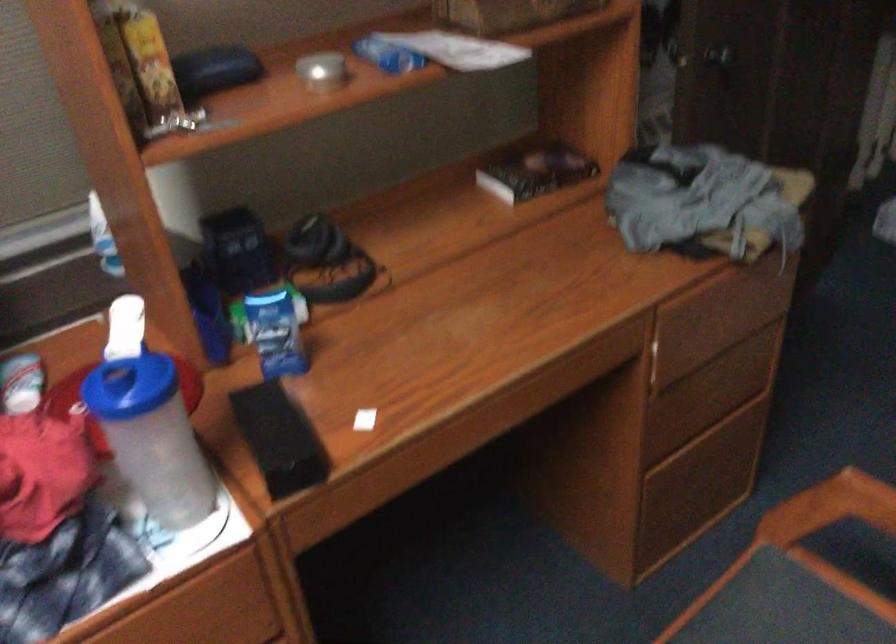
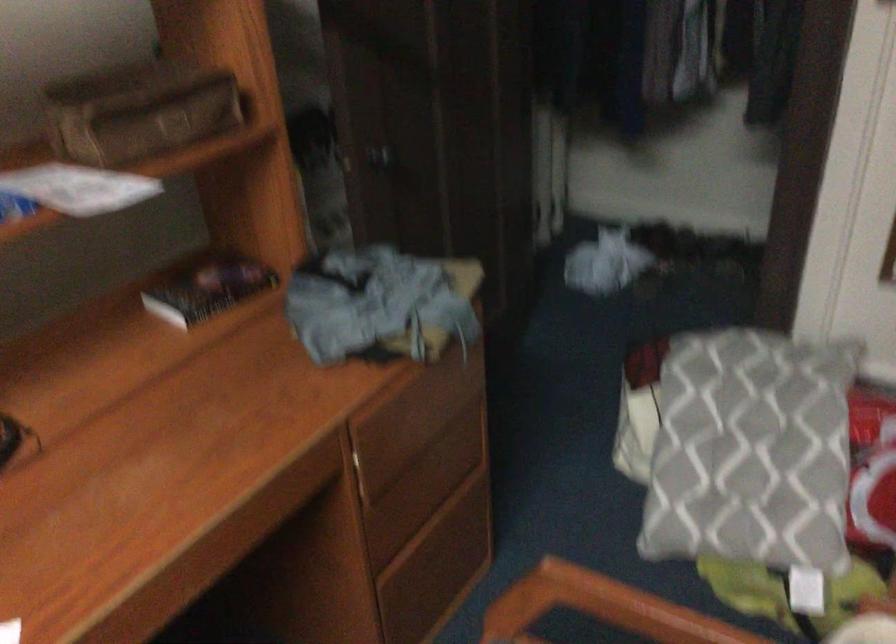
Question: The images are taken continuously from a first-person perspective. In which direction is your viewpoint rotating?

Choices:
 (A) Left
 (B) Right
 (C) Up
 (D) Down

Answer: (B)